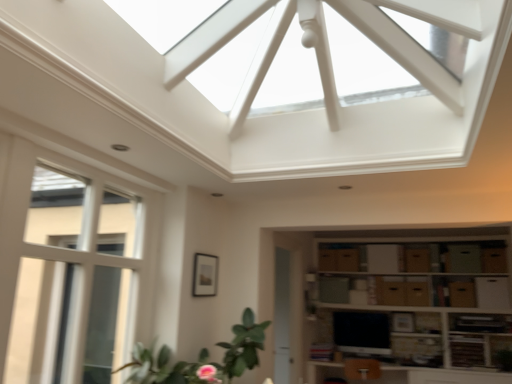
Question: From the image's perspective, does brown cardboard drawer at center, the third drawer in the left-to-right sequence, appear higher than green leafy plant at lower left?

Choices:
 (A) no
 (B) yes

Answer: (A)

Question: Is brown cardboard drawer at center, the third drawer in the left-to-right sequence, looking in the opposite direction of green leafy plant at lower left?

Choices:
 (A) no
 (B) yes

Answer: (A)

Question: Is brown cardboard drawer at center, which is the 4th drawer from right to left, positioned beyond the bounds of green leafy plant at lower left?

Choices:
 (A) yes
 (B) no

Answer: (A)

Question: Considering the relative positions of brown cardboard drawer at center, which is the 4th drawer from right to left, and green leafy plant at lower left in the image provided, is brown cardboard drawer at center, which is the 4th drawer from right to left, to the right of green leafy plant at lower left from the viewer's perspective?

Choices:
 (A) no
 (B) yes

Answer: (B)

Question: From a real-world perspective, does brown cardboard drawer at center, which is the 4th drawer from right to left, stand above green leafy plant at lower left?

Choices:
 (A) no
 (B) yes

Answer: (B)

Question: Does brown cardboard drawer at center, which is the 4th drawer from right to left, have a greater width compared to green leafy plant at lower left?

Choices:
 (A) yes
 (B) no

Answer: (B)

Question: Are matte black tv at lower center and brown cardboard drawer at center, the third drawer in the left-to-right sequence, making contact?

Choices:
 (A) no
 (B) yes

Answer: (A)

Question: Does matte black tv at lower center have a smaller size compared to brown cardboard drawer at center, which is the 4th drawer from right to left?

Choices:
 (A) no
 (B) yes

Answer: (A)

Question: Is the depth of matte black tv at lower center greater than that of brown cardboard drawer at center, the third drawer in the left-to-right sequence?

Choices:
 (A) yes
 (B) no

Answer: (A)

Question: Can you confirm if matte black tv at lower center is shorter than brown cardboard drawer at center, the third drawer in the left-to-right sequence?

Choices:
 (A) yes
 (B) no

Answer: (B)

Question: From the image's perspective, is matte black tv at lower center above brown cardboard drawer at center, which is the 4th drawer from right to left?

Choices:
 (A) yes
 (B) no

Answer: (B)

Question: From the image's perspective, is matte black tv at lower center below brown cardboard drawer at center, which is the 4th drawer from right to left?

Choices:
 (A) no
 (B) yes

Answer: (B)

Question: Considering the relative positions of brown cardboard drawer at lower right, the 1th drawer when ordered from right to left, and matte black tv at lower center in the image provided, is brown cardboard drawer at lower right, the 1th drawer when ordered from right to left, to the right of matte black tv at lower center from the viewer's perspective?

Choices:
 (A) yes
 (B) no

Answer: (A)